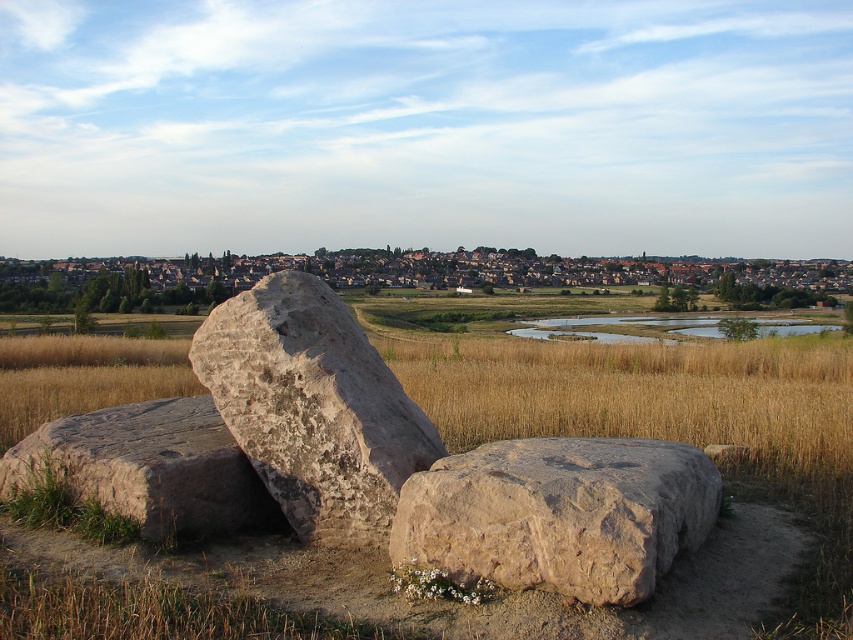
You are standing at the edge of the dry grassland looking towards the pond. You see the brown rough boulder at center and the brown rough stone at lower left. Which of these two objects is positioned to the right from your viewpoint?

The brown rough boulder at center is positioned to the right of the brown rough stone at lower left from your viewpoint.

You are standing at the edge of the dry grassland and want to place a 2.3 meter long wooden plank between the brown rough boulder at center and the brown rough stone at lower left. Will the plank reach both objects?

The distance between the brown rough boulder at center and the brown rough stone at lower left is 2.51 meters. Since the plank is only 2.3 meters long, it will be 0.21 meters too short to span the distance between them.